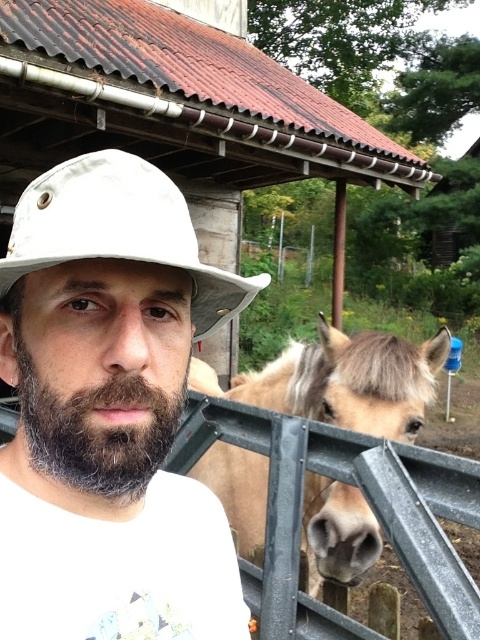
Does white matte hat at center have a greater height compared to white matte cowboy hat at center?

Correct, white matte hat at center is much taller as white matte cowboy hat at center.

You are a GUI agent. You are given a task and a screenshot of the screen. Output one action in this format:
    pyautogui.click(x=<x>, y=<y>)
    Task: Click on the white matte hat at center
    The image size is (480, 640).
    Given the screenshot: What is the action you would take?
    pyautogui.click(x=108, y=412)

Locate an element on the screen. The height and width of the screenshot is (640, 480). light brown fur at right is located at coordinates (343, 380).

Is point (410, 404) more distant than point (118, 435)?

Yes.

Locate an element on the screen. This screenshot has height=640, width=480. light brown fur at right is located at coordinates (343, 380).

From the picture: Measure the distance from light brown fur at right to white matte cowboy hat at center.

The distance of light brown fur at right from white matte cowboy hat at center is 4.64 feet.

Which is behind, point (320, 518) or point (202, 291)?

Point (320, 518)

Between point (226, 464) and point (121, 241), which one is positioned behind?

The point (226, 464) is more distant.

The width and height of the screenshot is (480, 640). Find the location of `light brown fur at right`. light brown fur at right is located at coordinates (343, 380).